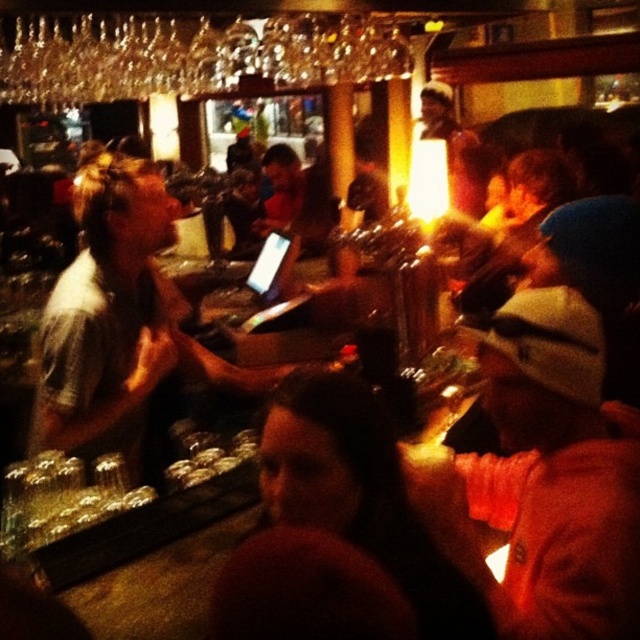
Question: Is the position of orange knit cap at lower right more distant than that of gray casual shirt at center?

Choices:
 (A) no
 (B) yes

Answer: (A)

Question: Can you confirm if orange knit cap at lower right is bigger than gray casual shirt at center?

Choices:
 (A) yes
 (B) no

Answer: (B)

Question: Which point is closer to the camera taking this photo?

Choices:
 (A) (104, 305)
 (B) (624, 608)

Answer: (B)

Question: Considering the relative positions of orange knit cap at lower right and gray casual shirt at center in the image provided, where is orange knit cap at lower right located with respect to gray casual shirt at center?

Choices:
 (A) right
 (B) left

Answer: (A)

Question: Which point appears closest to the camera in this image?

Choices:
 (A) (100, 262)
 (B) (518, 520)

Answer: (B)